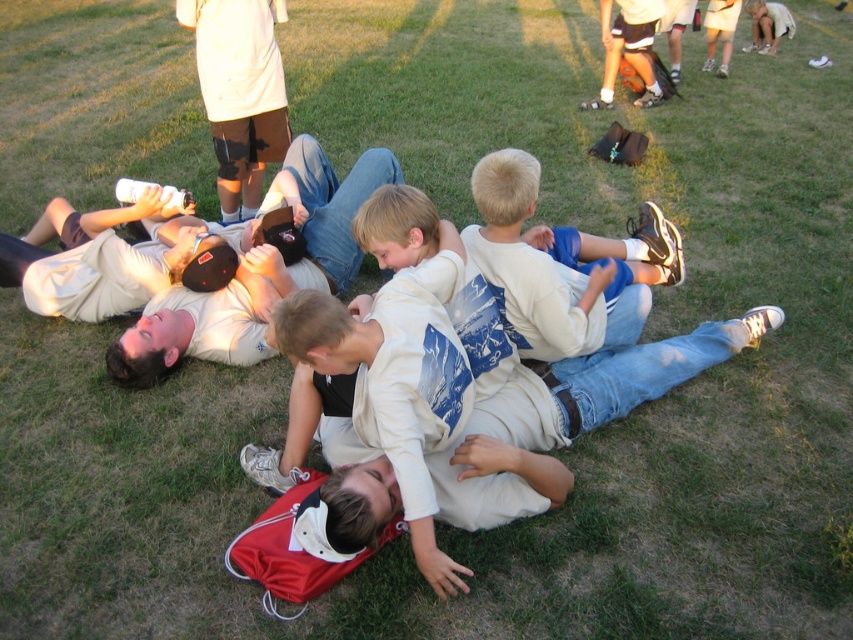
Question: Which object is farther from the camera taking this photo?

Choices:
 (A) matte khaki cap at upper left
 (B) white matte shirt at center
 (C) light beige shirt at upper right

Answer: (C)

Question: Which point is farther to the camera?

Choices:
 (A) matte khaki cap at upper left
 (B) light beige shirt at upper right

Answer: (B)

Question: Is white matte knee pad at upper center bigger than matte black shorts at upper center?

Choices:
 (A) yes
 (B) no

Answer: (A)

Question: Does white matte shirt at center appear under matte khaki cap at upper left?

Choices:
 (A) no
 (B) yes

Answer: (B)

Question: Which point is closer to the camera taking this photo?

Choices:
 (A) (143, 243)
 (B) (618, 26)
 (C) (315, 218)

Answer: (C)

Question: Does white cotton shirt at center appear over matte khaki cap at upper left?

Choices:
 (A) yes
 (B) no

Answer: (B)